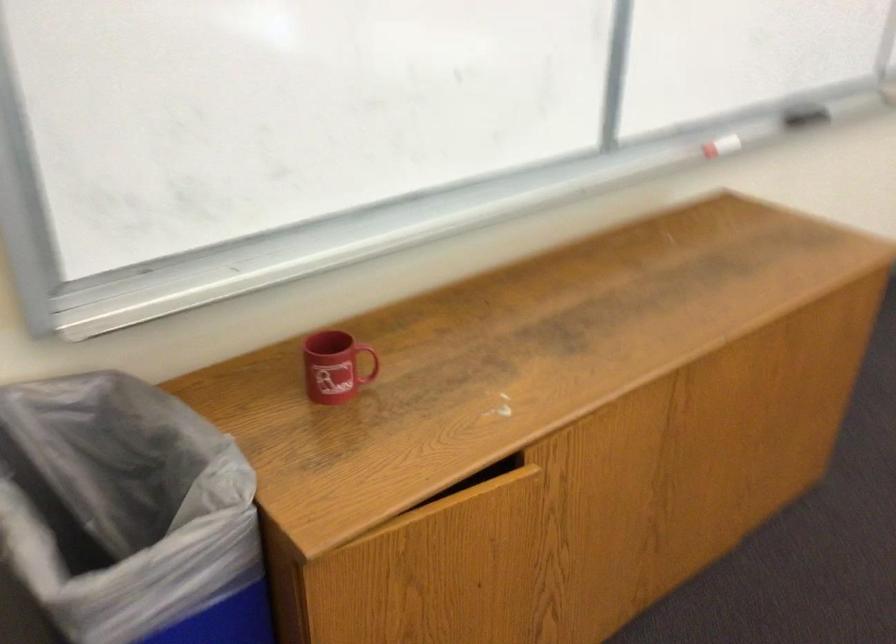
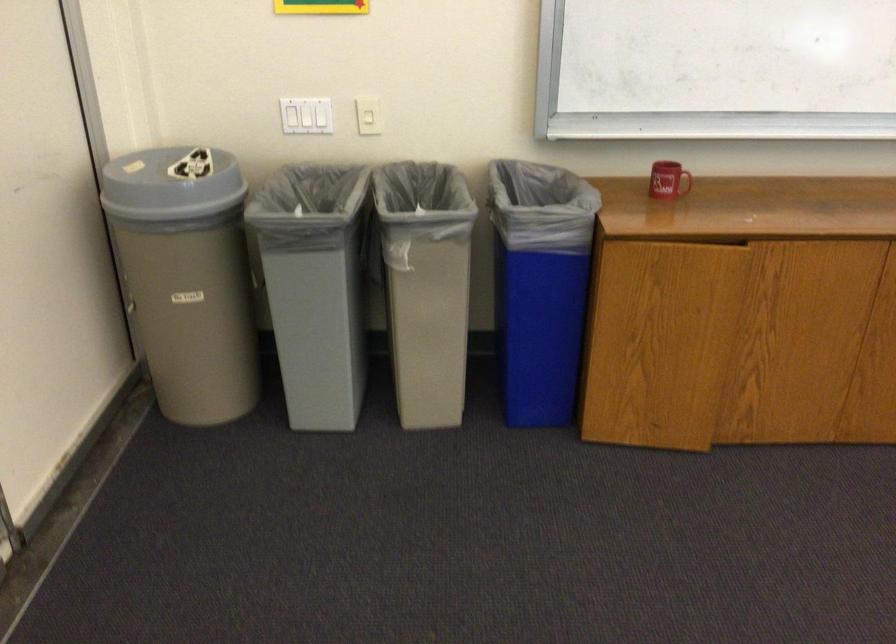
Where in the second image is the point corresponding to the point at 331,377 from the first image?

(664, 180)